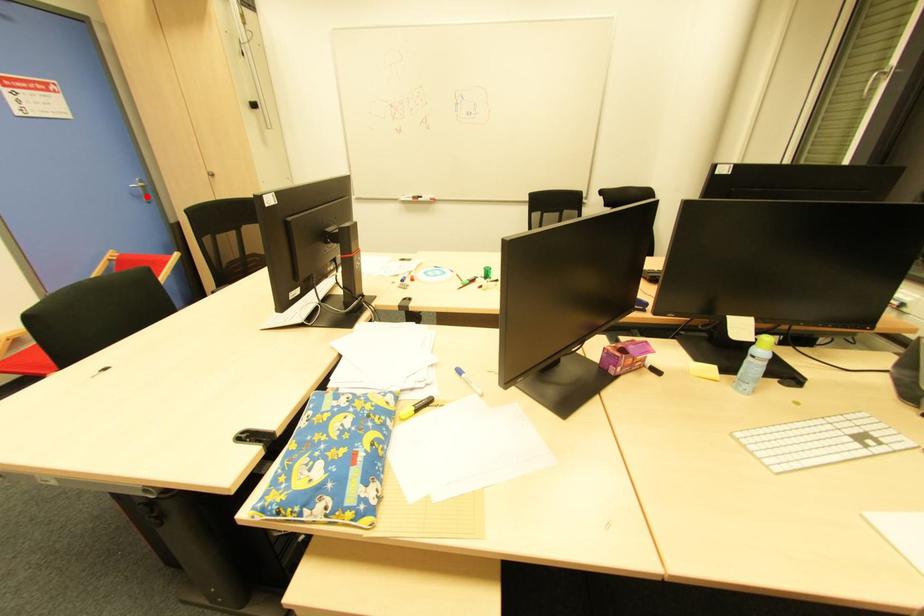
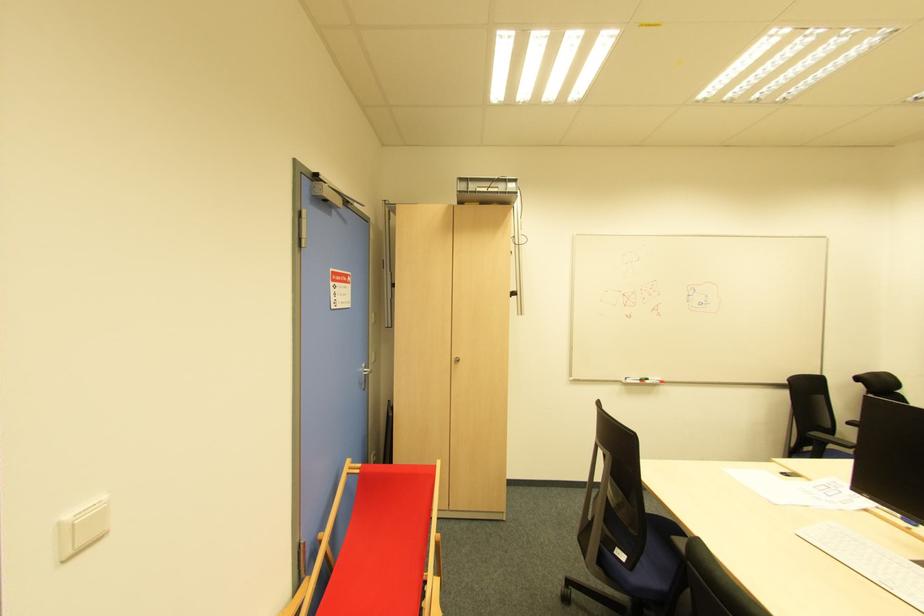
The point at the highlighted location is marked in the first image. Where is the corresponding point in the second image?

(366, 382)